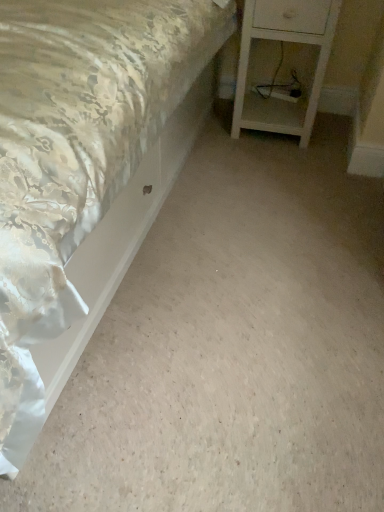
Question: Looking at their shapes, would you say silky satin bed at upper left is wider or thinner than white wood nightstand at lower right?

Choices:
 (A) thin
 (B) wide

Answer: (B)

Question: From their relative heights in the image, would you say silky satin bed at upper left is taller or shorter than white wood nightstand at lower right?

Choices:
 (A) tall
 (B) short

Answer: (B)

Question: From a real-world perspective, is silky satin bed at upper left above or below white wood nightstand at lower right?

Choices:
 (A) below
 (B) above

Answer: (A)

Question: Based on their sizes in the image, would you say white wood nightstand at lower right is bigger or smaller than silky satin bed at upper left?

Choices:
 (A) big
 (B) small

Answer: (B)

Question: Is white wood nightstand at lower right to the left or to the right of silky satin bed at upper left in the image?

Choices:
 (A) left
 (B) right

Answer: (B)

Question: Is white wood nightstand at lower right in front of or behind silky satin bed at upper left in the image?

Choices:
 (A) front
 (B) behind

Answer: (B)

Question: Considering the positions of point (311, 12) and point (119, 80), is point (311, 12) closer or farther from the camera than point (119, 80)?

Choices:
 (A) farther
 (B) closer

Answer: (A)